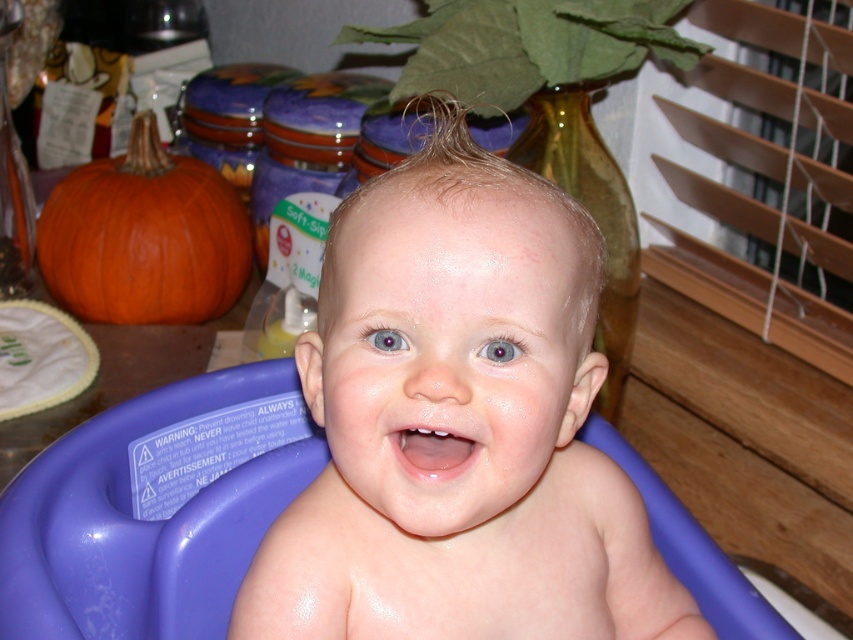
Consider the image. Where is the smooth skin baby at center?

The smooth skin baby at center is located at point (459, 426).

You are a parent trying to reach the orange matte pumpkin at left to give it to your child. The purple plastic bath at center is in the way. Can you move the pumpkin without moving the bath?

The purple plastic bath at center is in front of the orange matte pumpkin at left, so you cannot reach the pumpkin without moving the bath first.

You are a photographer trying to capture the perfect shot of the two points in the image. Which point, point [59,445] or point [70,204], is closer to you?

Point [59,445] is closer to the viewer than point [70,204].